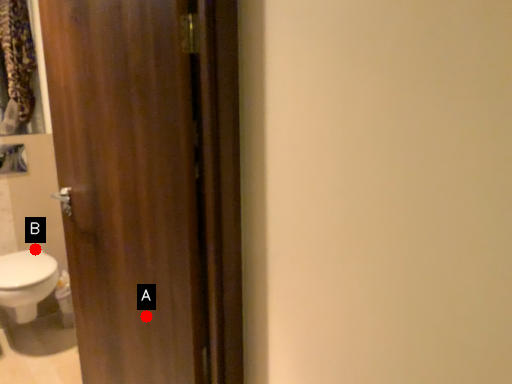
Question: Two points are circled on the image, labeled by A and B beside each circle. Which point appears farthest from the camera in this image?

Choices:
 (A) A is further
 (B) B is further

Answer: (B)